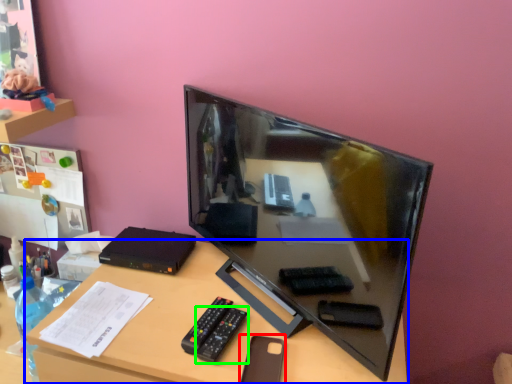
Question: Based on their relative distances, which object is nearer to stationery (highlighted by a red box)? Choose from desk (highlighted by a blue box) and remote (highlighted by a green box).

Choices:
 (A) desk
 (B) remote

Answer: (B)